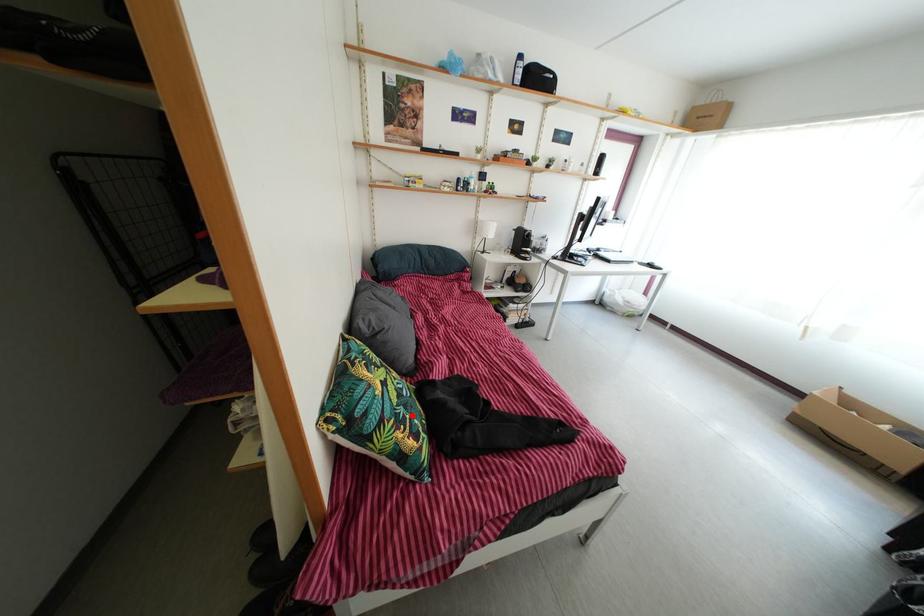
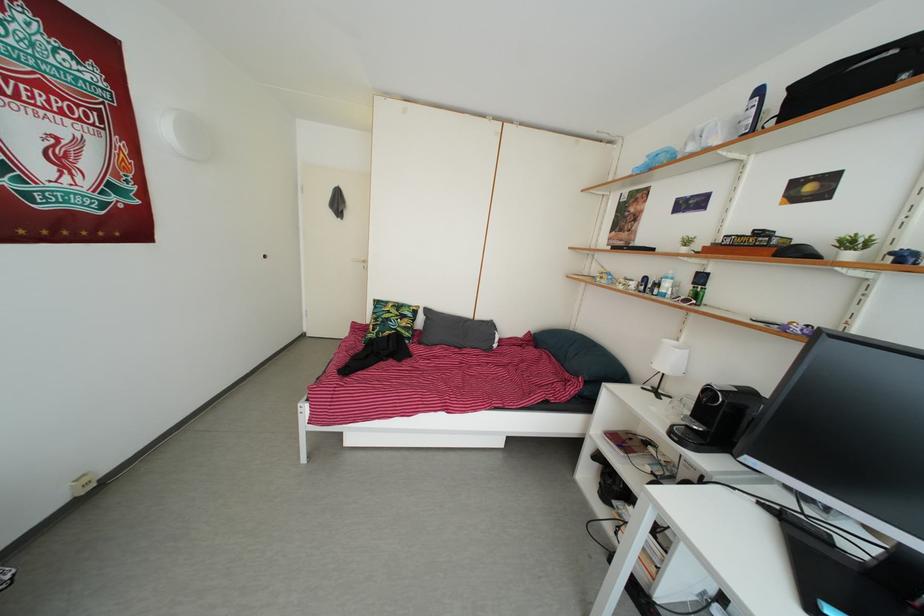
Where in the second image is the point corresponding to the highlighted location from the first image?

(388, 330)